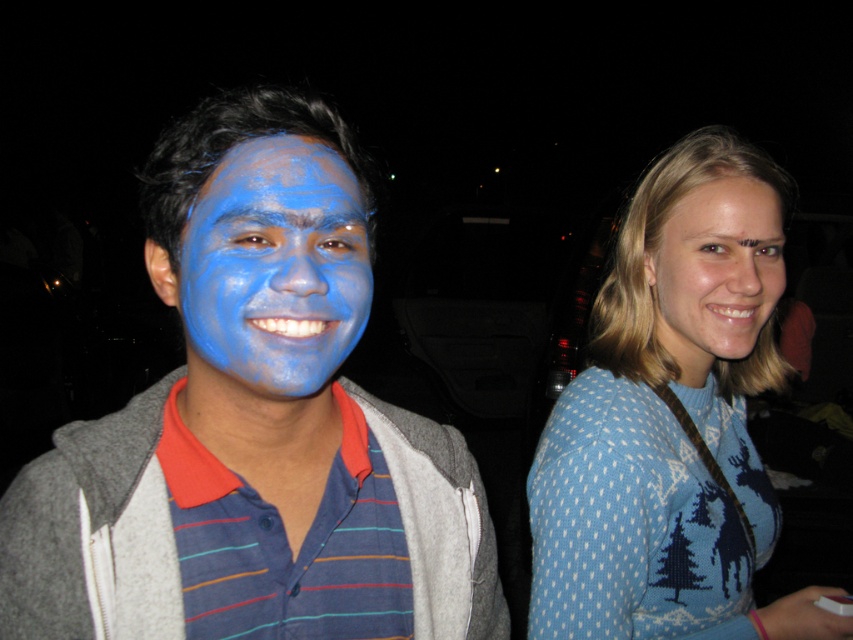
What do you see at coordinates (672, 419) in the screenshot?
I see `blue knitted sweater at upper right` at bounding box center [672, 419].

Which of these two, blue knitted sweater at upper right or blue matte face at left, stands taller?

blue knitted sweater at upper right

Is point (637, 572) positioned after point (225, 227)?

That is True.

Locate an element on the screen. Image resolution: width=853 pixels, height=640 pixels. blue knitted sweater at upper right is located at coordinates (672, 419).

Is blue matte face at left in front of blue matte face at right?

Yes, blue matte face at left is closer to the viewer.

Who is more distant from viewer, (300, 248) or (648, 257)?

The point (648, 257) is behind.

Find the location of a particular element. blue matte face at left is located at coordinates (276, 264).

Between matte blue face paint at center and blue knitted sweater at upper right, which one is positioned higher?

Positioned higher is blue knitted sweater at upper right.

Does matte blue face paint at center have a greater height compared to blue knitted sweater at upper right?

No, matte blue face paint at center is not taller than blue knitted sweater at upper right.

Does point (248, 600) come closer to viewer compared to point (741, 404)?

Yes, point (248, 600) is in front of point (741, 404).

At what (x,y) coordinates should I click in order to perform the action: click on matte blue face paint at center. Please return your answer as a coordinate pair (x, y). The image size is (853, 640). Looking at the image, I should click on (252, 410).